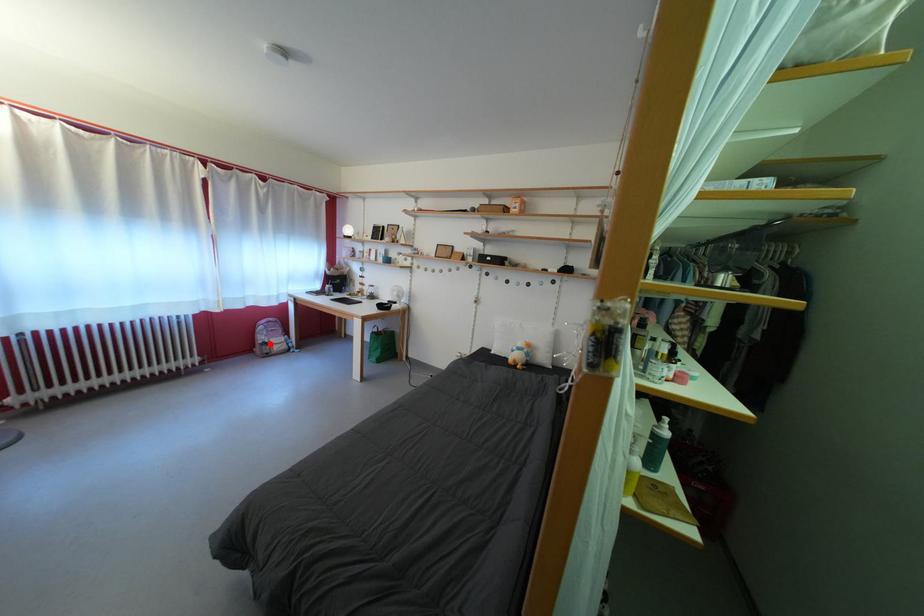
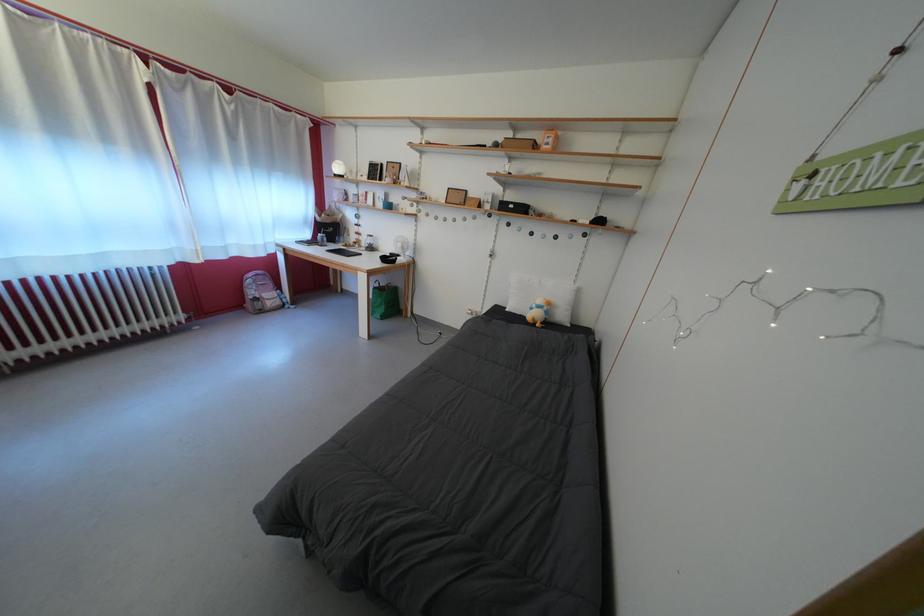
Question: A red point is marked in image1. In image2, is the corresponding 3D point closer to the camera or farther? Reply with the corresponding letter.

Choices:
 (A) The corresponding 3D point is closer.
 (B) The corresponding 3D point is farther.

Answer: (A)